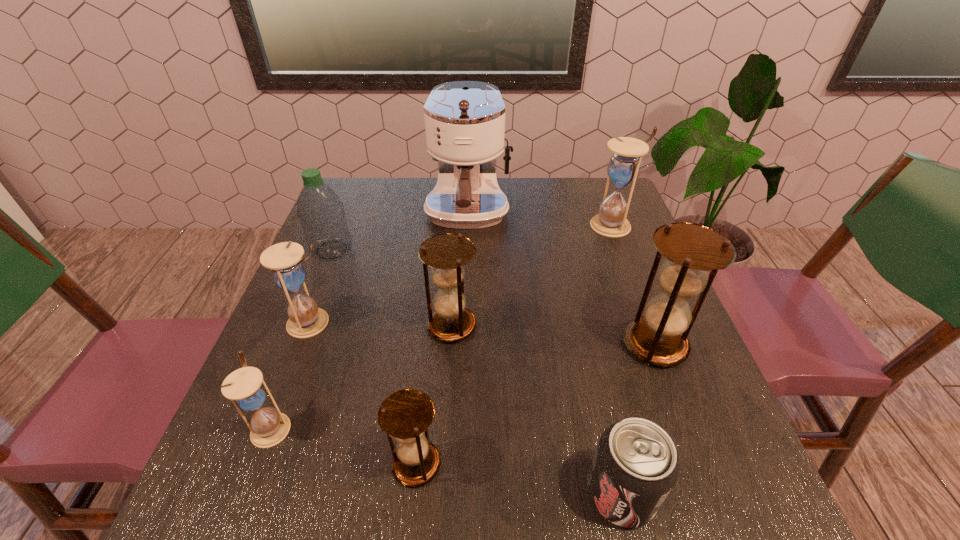
Where is `coffee maker`? The image size is (960, 540). coffee maker is located at coordinates (464, 120).

You are a GUI agent. You are given a task and a screenshot of the screen. Output one action in this format:
    pyautogui.click(x=<x>, y=<y>)
    Task: Click on the tallest object
    This screenshot has height=540, width=960.
    Given the screenshot: What is the action you would take?
    pyautogui.click(x=464, y=120)

Locate an element on the screen. The image size is (960, 540). the farthest white hourglass is located at coordinates (623, 168).

Image resolution: width=960 pixels, height=540 pixels. Find the location of `the biggest white hourglass`. the biggest white hourglass is located at coordinates [623, 168].

At what (x,y) coordinates should I click in order to perform the action: click on the biggest brown hourglass. Please return your answer as a coordinate pair (x, y). Looking at the image, I should click on (659, 337).

This screenshot has height=540, width=960. I want to click on water bottle, so click(x=320, y=211).

The height and width of the screenshot is (540, 960). What are the coordinates of `the second smallest white hourglass` in the screenshot? It's located at (305, 320).

The height and width of the screenshot is (540, 960). In order to click on the second biggest brown hourglass in this screenshot , I will do `click(446, 254)`.

Locate an element on the screen. The width and height of the screenshot is (960, 540). the nearest white hourglass is located at coordinates coord(245,387).

I want to click on the nearest brown hourglass, so click(405, 415).